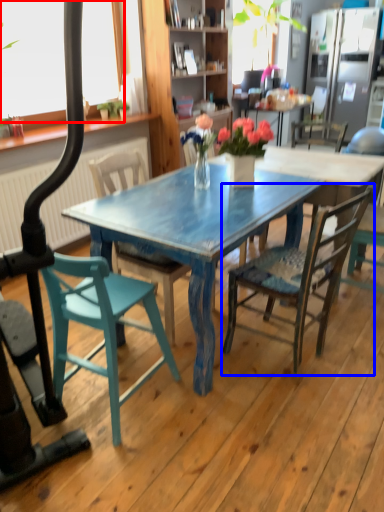
Question: Among these objects, which one is farthest to the camera, window screen (highlighted by a red box) or chair (highlighted by a blue box)?

Choices:
 (A) window screen
 (B) chair

Answer: (A)